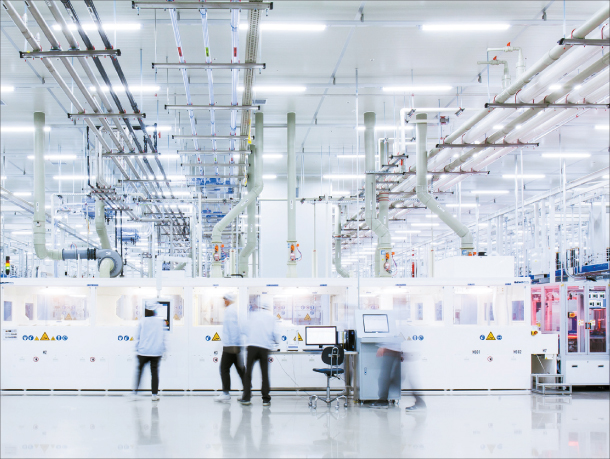
You are a GUI agent. You are given a task and a screenshot of the screen. Output one action in this format:
    pyautogui.click(x=<x>, y=<y>)
    Task: Click on the step stool
    The height and width of the screenshot is (459, 610).
    Given the screenshot: What is the action you would take?
    pyautogui.click(x=546, y=384)